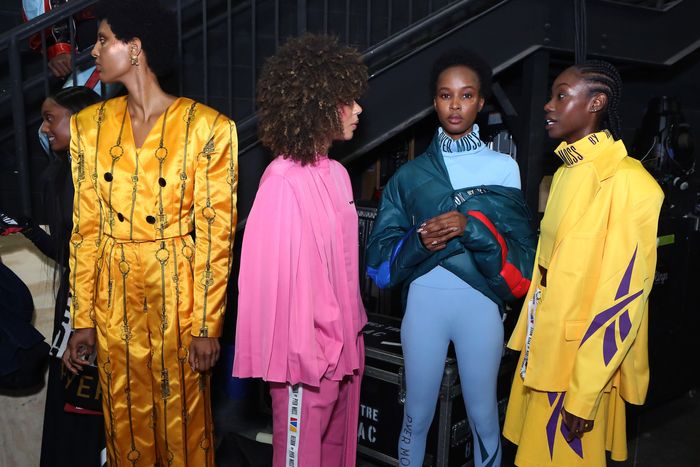
You are a GUI agent. You are given a task and a screenshot of the screen. Output one action in this format:
    pyautogui.click(x=<x>, y=<y>)
    Task: Click on the side stairway
    
    Given the screenshot: What is the action you would take?
    pyautogui.click(x=391, y=100)